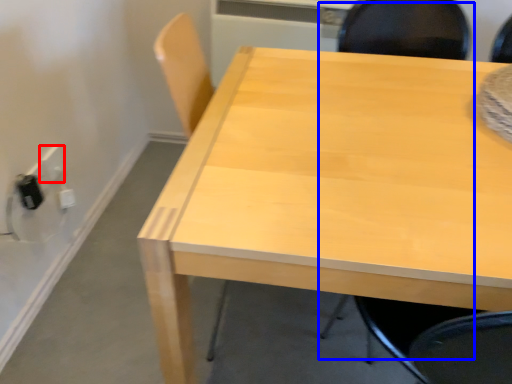
Question: Which of the following is the closest to the observer, electric outlet (highlighted by a red box) or chair (highlighted by a blue box)?

Choices:
 (A) electric outlet
 (B) chair

Answer: (B)